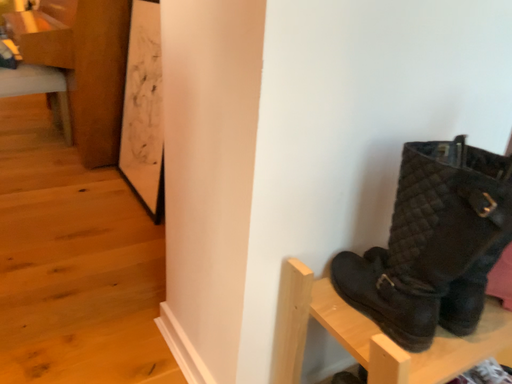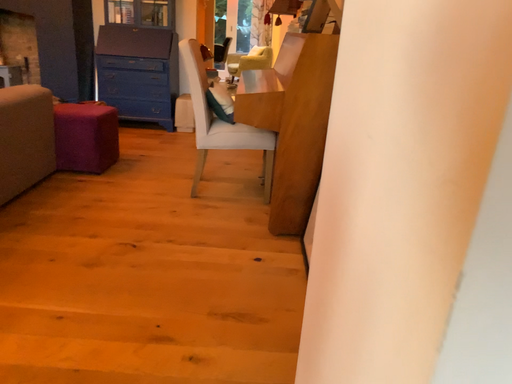
Question: Which way did the camera rotate in the video?

Choices:
 (A) rotated upward
 (B) rotated downward

Answer: (A)